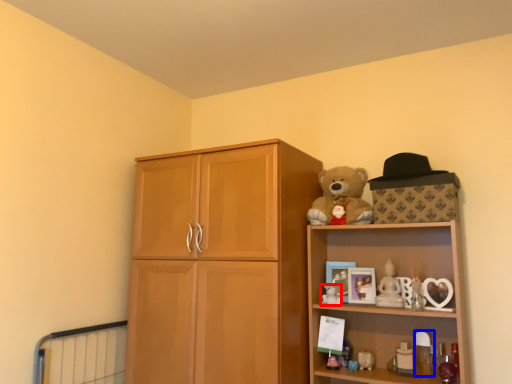
Question: Which object is further to the camera taking this photo, toy (highlighted by a red box) or toy (highlighted by a blue box)?

Choices:
 (A) toy
 (B) toy

Answer: (A)